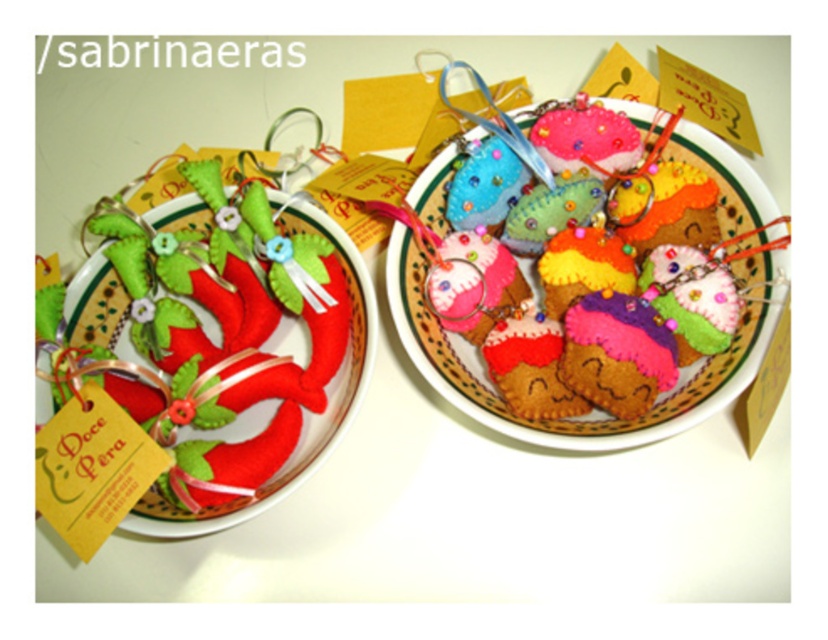
Who is positioned more to the left, multicolored felt hearts at center or matte felt paper plate at left?

From the viewer's perspective, matte felt paper plate at left appears more on the left side.

Between multicolored felt hearts at center and matte felt paper plate at left, which one has less height?

With less height is matte felt paper plate at left.

You are a GUI agent. You are given a task and a screenshot of the screen. Output one action in this format:
    pyautogui.click(x=<x>, y=<y>)
    Task: Click on the multicolored felt hearts at center
    The image size is (828, 640).
    Given the screenshot: What is the action you would take?
    pyautogui.click(x=569, y=419)

This screenshot has width=828, height=640. Find the location of `multicolored felt hearts at center`. multicolored felt hearts at center is located at coordinates (569, 419).